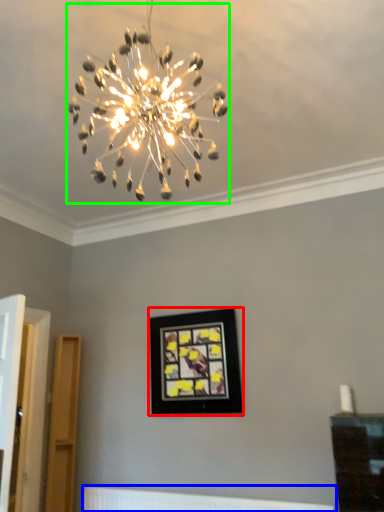
Question: Which is nearer to the picture frame (highlighted by a red box)? radiator (highlighted by a blue box) or lamp (highlighted by a green box).

Choices:
 (A) radiator
 (B) lamp

Answer: (A)